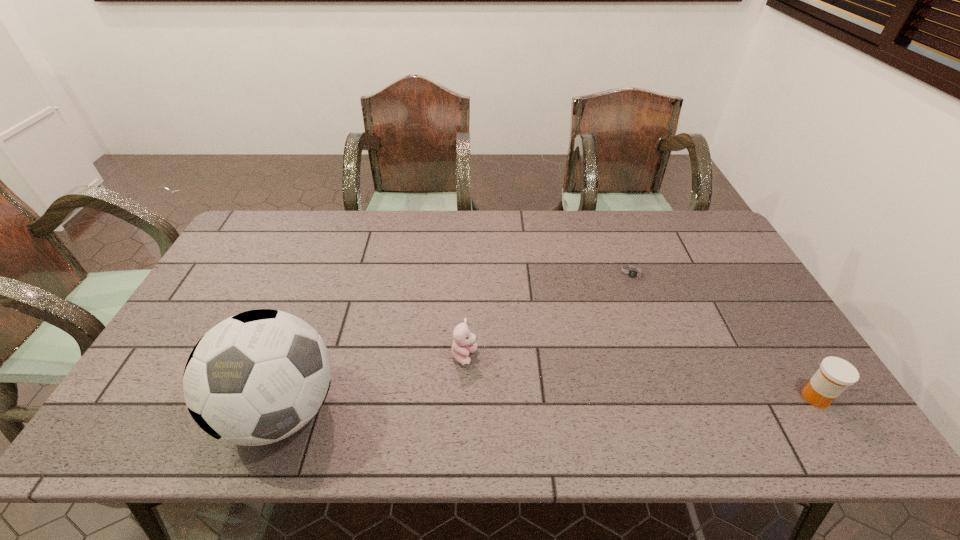
Identify the location of free location located 0.090m on the face of the watch. (631, 305).

This screenshot has width=960, height=540. I want to click on vacant space located 0.340m on the face of the watch, so click(x=626, y=375).

Find the location of a particular element. This screenshot has height=540, width=960. soccer ball situated at the near edge is located at coordinates (257, 377).

Identify the location of medicine at the near edge. (835, 374).

At what (x,y) coordinates should I click in order to perform the action: click on object that is positioned at the right edge. Please return your answer as a coordinate pair (x, y). Looking at the image, I should click on (835, 374).

This screenshot has width=960, height=540. What are the coordinates of `object located at the near right corner` in the screenshot? It's located at (835, 374).

You are a GUI agent. You are given a task and a screenshot of the screen. Output one action in this format:
    pyautogui.click(x=<x>, y=<y>)
    Task: Click on the vacant space at the far edge of the desktop
    The image size is (960, 540).
    Given the screenshot: What is the action you would take?
    point(463,252)

Find the location of `vacant space at the near edge of the desktop`. vacant space at the near edge of the desktop is located at coordinates (350, 400).

Locate an element on the screen. vacant area at the left edge is located at coordinates (203, 327).

The width and height of the screenshot is (960, 540). Find the location of `vacant space at the right edge`. vacant space at the right edge is located at coordinates (692, 262).